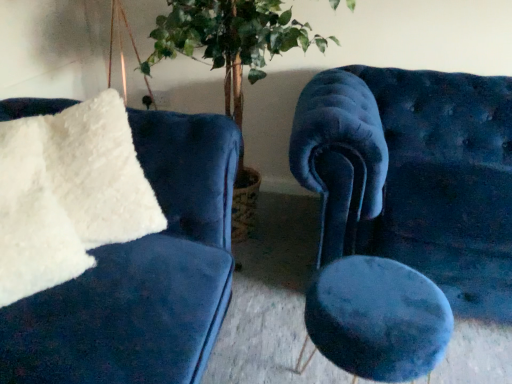
Question: Is white fluffy pillow at left to the left of velvet blue stool at center from the viewer's perspective?

Choices:
 (A) no
 (B) yes

Answer: (B)

Question: Considering the relative sizes of white fluffy pillow at left and velvet blue stool at center in the image provided, is white fluffy pillow at left wider than velvet blue stool at center?

Choices:
 (A) no
 (B) yes

Answer: (A)

Question: From the image's perspective, is white fluffy pillow at left above velvet blue stool at center?

Choices:
 (A) yes
 (B) no

Answer: (A)

Question: Is white fluffy pillow at left oriented away from velvet blue stool at center?

Choices:
 (A) yes
 (B) no

Answer: (B)

Question: Is white fluffy pillow at left next to velvet blue stool at center?

Choices:
 (A) yes
 (B) no

Answer: (B)

Question: Is the depth of white fluffy pillow at left greater than that of velvet blue stool at center?

Choices:
 (A) yes
 (B) no

Answer: (B)

Question: Is velvet blue stool at center positioned behind green leafy plant at center?

Choices:
 (A) yes
 (B) no

Answer: (B)

Question: Could green leafy plant at center be considered to be inside velvet blue stool at center?

Choices:
 (A) no
 (B) yes

Answer: (A)

Question: Is velvet blue stool at center to the right of green leafy plant at center from the viewer's perspective?

Choices:
 (A) yes
 (B) no

Answer: (A)

Question: Is velvet blue stool at center wider than green leafy plant at center?

Choices:
 (A) no
 (B) yes

Answer: (A)

Question: Is green leafy plant at center at the back of velvet blue stool at center?

Choices:
 (A) no
 (B) yes

Answer: (B)

Question: From the image's perspective, does velvet blue stool at center appear higher than green leafy plant at center?

Choices:
 (A) no
 (B) yes

Answer: (A)

Question: Does velvet blue chair at right have a lesser height compared to white fluffy pillow at left?

Choices:
 (A) yes
 (B) no

Answer: (B)